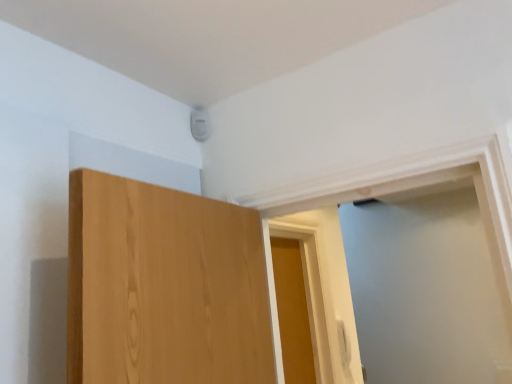
The height and width of the screenshot is (384, 512). What do you see at coordinates (292, 312) in the screenshot? I see `wooden door at center` at bounding box center [292, 312].

Locate an element on the screen. Image resolution: width=512 pixels, height=384 pixels. wooden door at center is located at coordinates (292, 312).

You are a GUI agent. You are given a task and a screenshot of the screen. Output one action in this format:
    pyautogui.click(x=<x>, y=<y>)
    Task: Click on the wooden door at center
    The width and height of the screenshot is (512, 384).
    Given the screenshot: What is the action you would take?
    pyautogui.click(x=292, y=312)